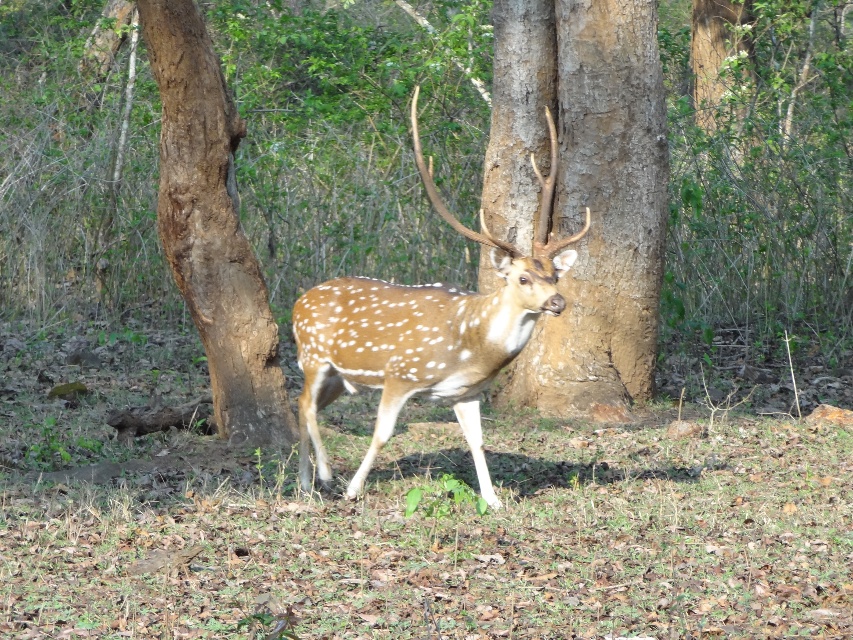
You are a photographer trying to capture the spotted fur deer at center without the brown rough tree trunk at center blocking the view. Can you adjust your position to do so?

The brown rough tree trunk at center is above the spotted fur deer at center, so if you lower your camera angle or move to a position where the deer is not directly under the tree trunk, you can avoid the trunk blocking the view.

You are a hiker carrying a 10 meter long rope. You want to tie the rope between the brown rough tree trunk at center and a tree 5 meters behind it. Is the rope long enough?

The distance between the brown rough tree trunk at center and the tree 5 meters behind it is 5 meters. Since the rope is 10 meters long, it is twice as long as needed. Therefore, the rope is long enough to tie between the two trees.

You are a wildlife photographer aiming to capture the spotted fur deer at center. Based on its position in the forested area, where should you focus your camera to ensure the deer is centered in your shot?

The spotted fur deer at center is located at point coordinates approximately at the center of the image, so focusing your camera at the center point will ensure the deer is centered in your shot.